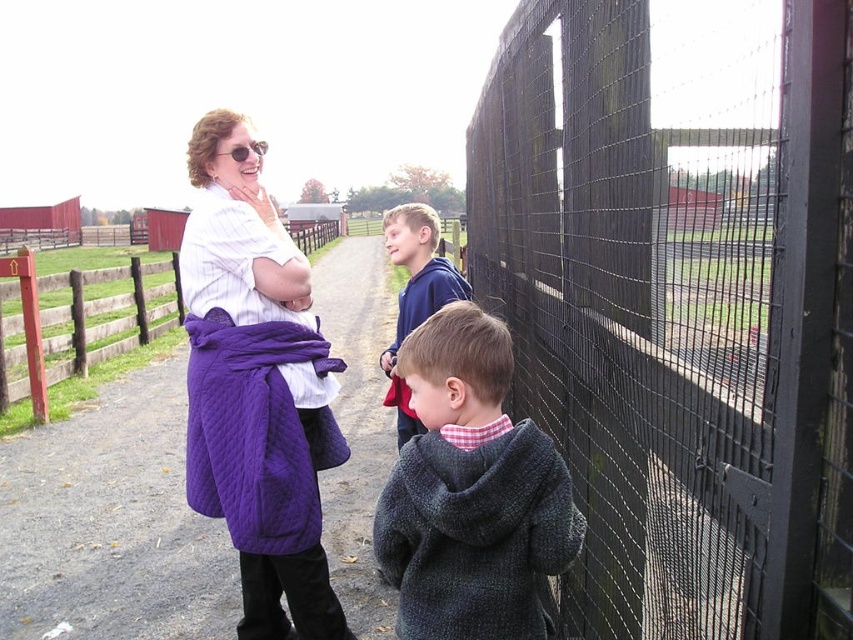
From the picture: You are planning to place a new bench in the middle of the path between the purple quilted coat at center and the purple quilted coat at left. The bench is 5 feet long. Will there be enough space between the two coats to place the bench?

The distance between the purple quilted coat at center and the purple quilted coat at left is 23.61 feet. Since the bench is only 5 feet long, there is sufficient space to place it between them.

You are trying to decide which clothing item to take with you on a hike. You have a purple quilted coat at center and a dark gray knitted sweater at center. Based on the image, which one do you think is wider?

The purple quilted coat at center might be wider than dark gray knitted sweater at center, so you should take the purple quilted coat at center if you need a wider garment.

You are a photographer trying to capture a group photo of the purple quilted coat at center and the blue fleece jacket at center. If you want to ensure both coats are fully visible in the frame, which coat requires more space horizontally?

The blue fleece jacket at center requires more space horizontally because its width is greater than the purple quilted coat at center.